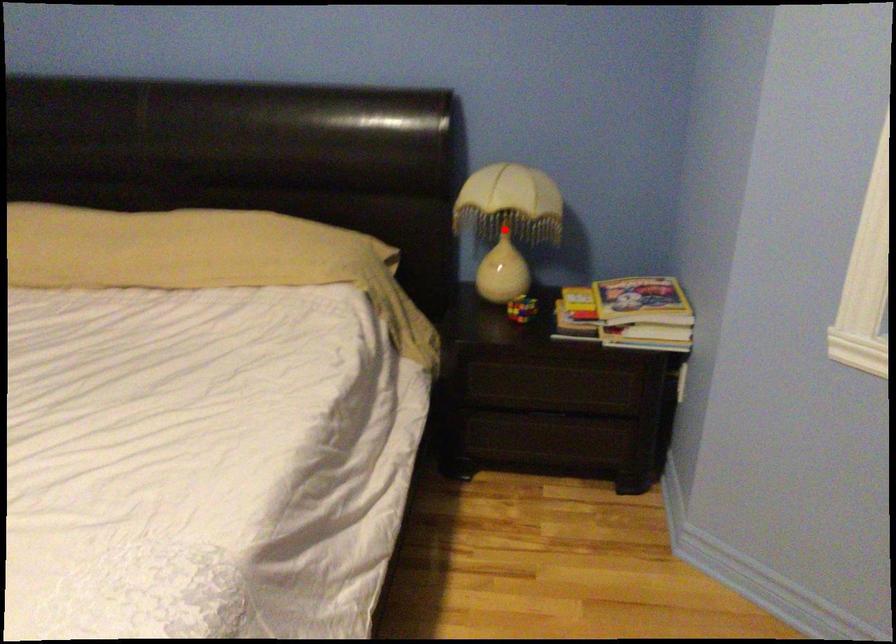
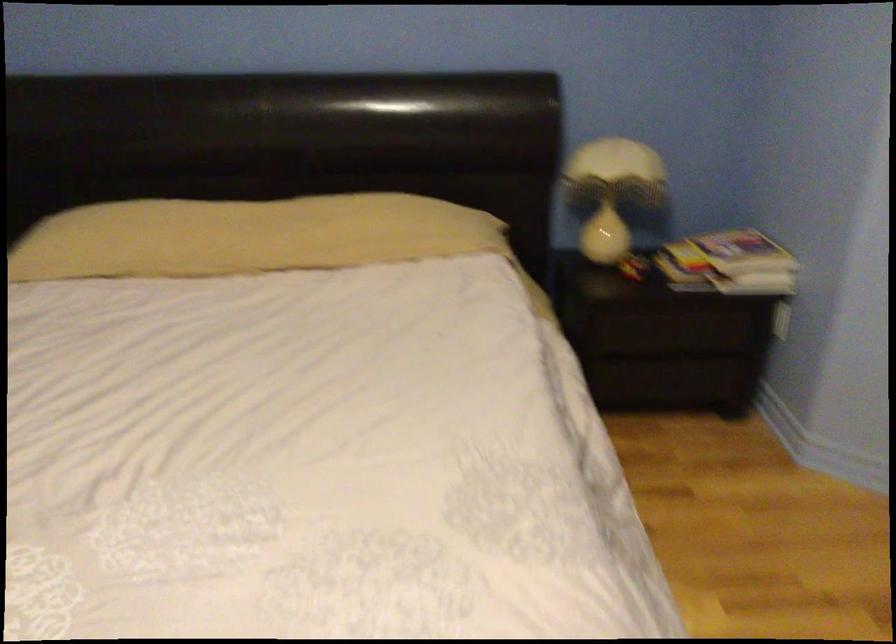
Find the pixel in the second image that matches the highlighted location in the first image.

(613, 191)